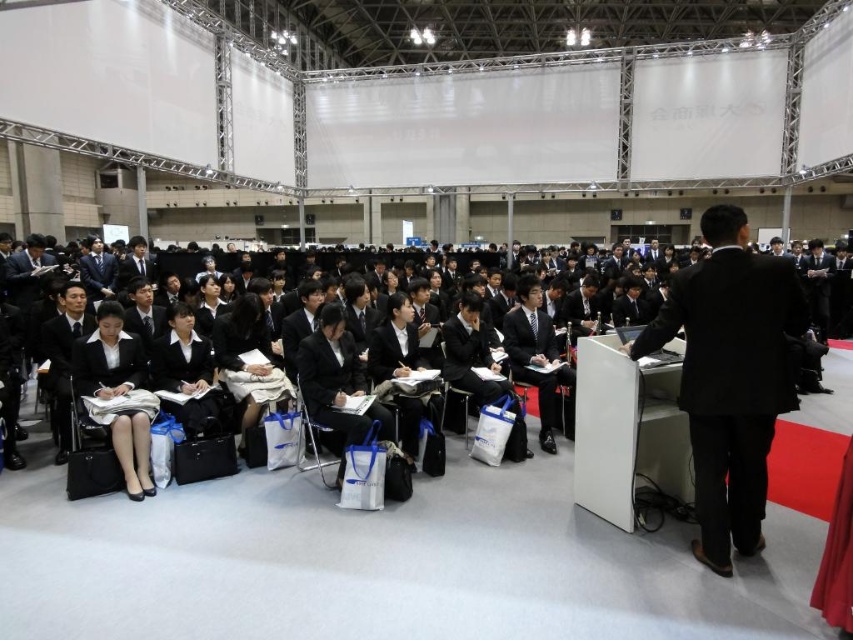
You are a photographer at the event and need to capture a clear shot of both the black fabric skirt at lower left and the matte black suit at center. Since the speaker is moving, will the skirt be in front of or behind the suit?

The black fabric skirt at lower left is positioned under the matte black suit at center, so it will be behind the suit and not block the view.